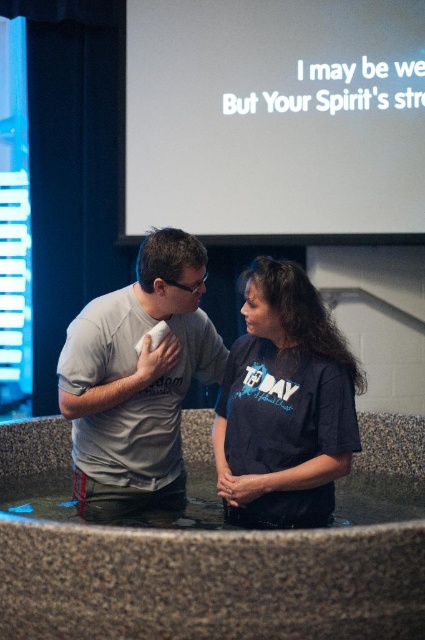
Between white matte projection screen at upper center and gray matte t-shirt at center, which one is positioned lower?

gray matte t-shirt at center is lower down.

Measure the distance between white matte projection screen at upper center and camera.

A distance of 4.09 meters exists between white matte projection screen at upper center and camera.

Between point (215, 164) and point (110, 497), which one is positioned behind?

The point (215, 164) is more distant.

You are a GUI agent. You are given a task and a screenshot of the screen. Output one action in this format:
    pyautogui.click(x=<x>, y=<y>)
    Task: Click on the white matte projection screen at upper center
    The height and width of the screenshot is (640, 425).
    Given the screenshot: What is the action you would take?
    pyautogui.click(x=274, y=116)

Can you confirm if white matte projection screen at upper center is thinner than dark blue t-shirt at center?

No, white matte projection screen at upper center is not thinner than dark blue t-shirt at center.

I want to click on white matte projection screen at upper center, so click(x=274, y=116).

What are the coordinates of `white matte projection screen at upper center` in the screenshot? It's located at (274, 116).

Does point (79, 435) come in front of point (331, 387)?

No, it is behind (331, 387).

Does point (135, 392) come in front of point (269, 472)?

No, it is behind (269, 472).

Where is `gray matte t-shirt at center`? This screenshot has width=425, height=640. gray matte t-shirt at center is located at coordinates (138, 378).